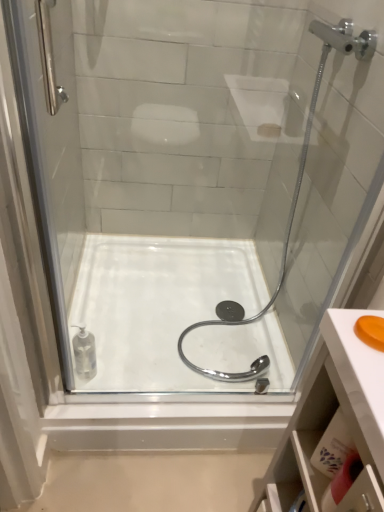
Find the location of a particular element. The image size is (384, 512). white glossy bath at center is located at coordinates click(157, 306).

The width and height of the screenshot is (384, 512). What do you see at coordinates (157, 306) in the screenshot?
I see `white glossy bath at center` at bounding box center [157, 306].

What is the approximate width of white glossy bath at center?

It is 33.55 inches.

What do you see at coordinates (371, 331) in the screenshot?
I see `orange matte soap at upper right` at bounding box center [371, 331].

This screenshot has height=512, width=384. Find the location of `orange matte soap at upper right`. orange matte soap at upper right is located at coordinates (371, 331).

Find the location of `white glossy bath at center`. white glossy bath at center is located at coordinates (157, 306).

From the picture: Between orange matte soap at upper right and white glossy bath at center, which one appears on the left side from the viewer's perspective?

white glossy bath at center is more to the left.

Which object is further away from the camera, orange matte soap at upper right or white glossy bath at center?

white glossy bath at center is further away from the camera.

Based on the photo, which is farther from the camera, (378, 342) or (256, 325)?

The point (256, 325) is more distant.

From the image's perspective, which is below, orange matte soap at upper right or white glossy bath at center?

white glossy bath at center, from the image's perspective.

From a real-world perspective, is orange matte soap at upper right physically located above or below white glossy bath at center?

Clearly, from a real-world perspective, orange matte soap at upper right is above white glossy bath at center.

Does orange matte soap at upper right have a greater width compared to white glossy bath at center?

In fact, orange matte soap at upper right might be narrower than white glossy bath at center.

Considering the relative sizes of orange matte soap at upper right and white glossy bath at center in the image provided, is orange matte soap at upper right taller than white glossy bath at center?

No.

Based on their sizes in the image, would you say orange matte soap at upper right is bigger or smaller than white glossy bath at center?

In the image, orange matte soap at upper right appears to be smaller than white glossy bath at center.

Can white glossy bath at center be found inside orange matte soap at upper right?

No, white glossy bath at center is located outside of orange matte soap at upper right.

Is orange matte soap at upper right far from white glossy bath at center?

Yes, orange matte soap at upper right and white glossy bath at center are quite far apart.

Does orange matte soap at upper right turn towards white glossy bath at center?

No, orange matte soap at upper right is not aimed at white glossy bath at center.

How far apart are orange matte soap at upper right and white glossy bath at center?

orange matte soap at upper right and white glossy bath at center are 1.09 meters apart from each other.

What are the coordinates of `bath behind the orange matte soap at upper right` in the screenshot? It's located at (157, 306).

In the scene shown: Is white glossy bath at center to the right of orange matte soap at upper right from the viewer's perspective?

In fact, white glossy bath at center is to the left of orange matte soap at upper right.

Is white glossy bath at center behind orange matte soap at upper right?

Yes, it is.

Does point (110, 260) come closer to viewer compared to point (361, 340)?

No.

Looking at this image, from the image's perspective, is white glossy bath at center above or below orange matte soap at upper right?

Clearly, from the image's perspective, white glossy bath at center is below orange matte soap at upper right.

From a real-world perspective, relative to orange matte soap at upper right, is white glossy bath at center vertically above or below?

In terms of real-world spatial position, white glossy bath at center is below orange matte soap at upper right.

Can you confirm if white glossy bath at center is wider than orange matte soap at upper right?

Indeed, white glossy bath at center has a greater width compared to orange matte soap at upper right.

Can you confirm if white glossy bath at center is shorter than orange matte soap at upper right?

Incorrect, the height of white glossy bath at center does not fall short of that of orange matte soap at upper right.

Based on the photo, can you confirm if white glossy bath at center is bigger than orange matte soap at upper right?

Correct, white glossy bath at center is larger in size than orange matte soap at upper right.

Is white glossy bath at center completely or partially outside of orange matte soap at upper right?

white glossy bath at center lies outside orange matte soap at upper right's area.

Is white glossy bath at center not near orange matte soap at upper right?

That's right, there is a large distance between white glossy bath at center and orange matte soap at upper right.

Is white glossy bath at center turned away from orange matte soap at upper right?

white glossy bath at center does not have its back to orange matte soap at upper right.

How much distance is there between white glossy bath at center and orange matte soap at upper right?

3.56 feet.

Identify the location of soap on the right side of white glossy bath at center. The image size is (384, 512). (371, 331).

Where is `soap located above the white glossy bath at center (from a real-world perspective)`? soap located above the white glossy bath at center (from a real-world perspective) is located at coordinates click(x=371, y=331).

Where is `soap on the right of the white glossy bath at center`? The width and height of the screenshot is (384, 512). soap on the right of the white glossy bath at center is located at coordinates (371, 331).